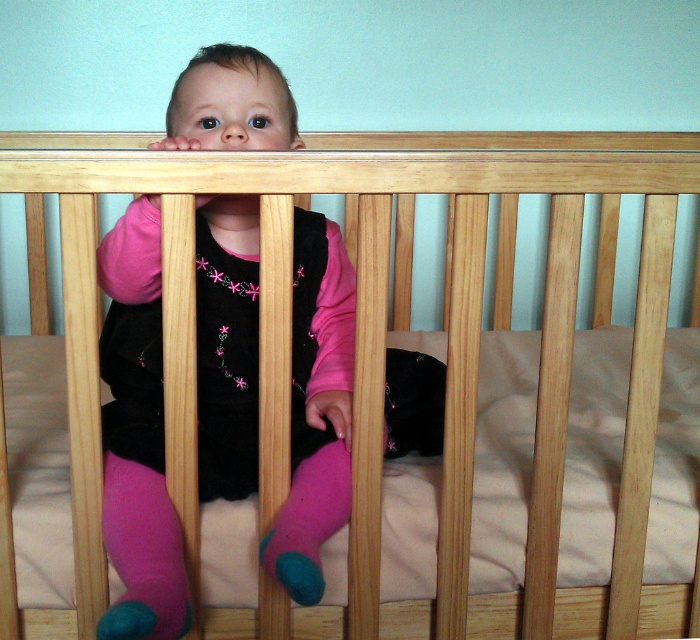
Question: Which of the following is the closest to the observer?

Choices:
 (A) (178, 618)
 (B) (252, 276)

Answer: (A)

Question: Observing the image, what is the correct spatial positioning of matte black dress at center in reference to pink fabric sock at lower left?

Choices:
 (A) left
 (B) right

Answer: (B)

Question: Which object is the farthest from the pink fabric sock at lower left?

Choices:
 (A) matte black dress at center
 (B) pink fuzzy sock at lower center

Answer: (A)

Question: Which of these objects is positioned farthest from the matte black dress at center?

Choices:
 (A) pink fuzzy sock at lower center
 (B) pink fabric sock at lower left

Answer: (B)

Question: Is pink fabric sock at lower left bigger than pink fuzzy sock at lower center?

Choices:
 (A) yes
 (B) no

Answer: (A)

Question: Can you confirm if matte black dress at center is wider than pink fabric sock at lower left?

Choices:
 (A) no
 (B) yes

Answer: (B)